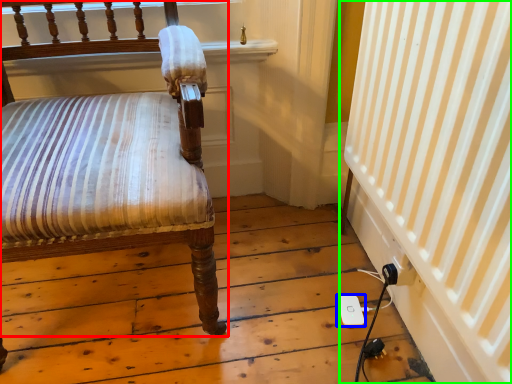
Question: Which object is positioned farthest from chair (highlighted by a red box)? Select from ipod (highlighted by a blue box) and curtain (highlighted by a green box).

Choices:
 (A) ipod
 (B) curtain

Answer: (A)